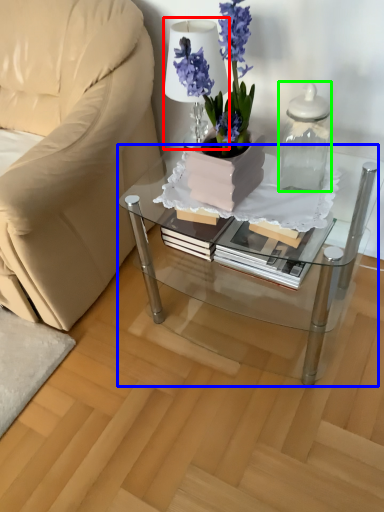
Question: Which object is the closest to the table lamp (highlighted by a red box)? Choose among these: coffee table (highlighted by a blue box) or vase (highlighted by a green box).

Choices:
 (A) coffee table
 (B) vase

Answer: (B)